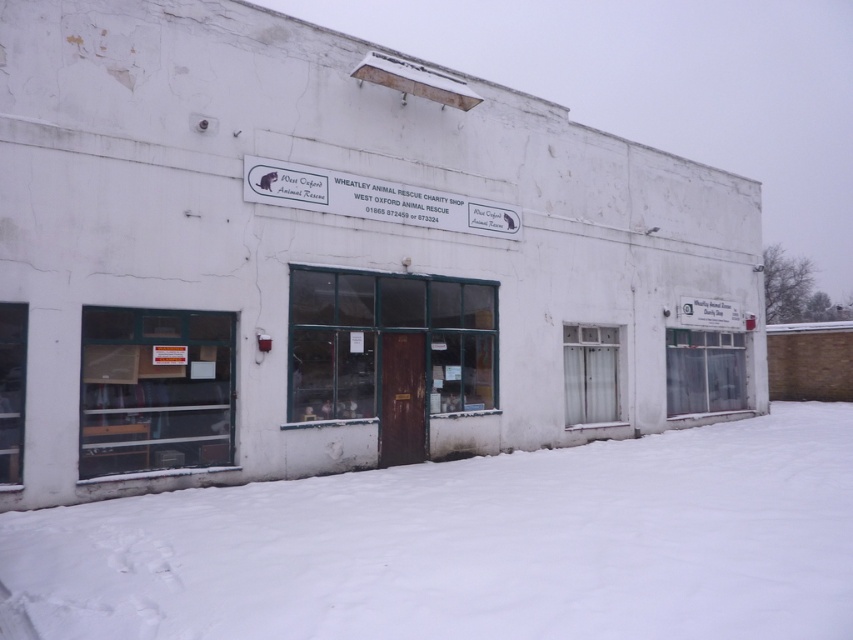
Question: Does white powdery snow at lower center come in front of clear glass shelves at lower left?

Choices:
 (A) yes
 (B) no

Answer: (A)

Question: In this image, where is clear glass shelves at lower left located relative to white plastic sign at upper center?

Choices:
 (A) above
 (B) below

Answer: (B)

Question: Where is clear glass shelves at lower left located in relation to white plastic sign at upper center in the image?

Choices:
 (A) right
 (B) left

Answer: (B)

Question: Among these objects, which one is farthest from the camera?

Choices:
 (A) white powdery snow at lower center
 (B) white plastic sign at upper center
 (C) clear glass shelves at lower left

Answer: (B)

Question: Among these points, which one is farthest from the camera?

Choices:
 (A) (312, 177)
 (B) (405, 586)
 (C) (114, 387)

Answer: (A)

Question: Which of the following is the farthest from the observer?

Choices:
 (A) tap(206, 417)
 (B) tap(444, 228)
 (C) tap(601, 442)

Answer: (C)